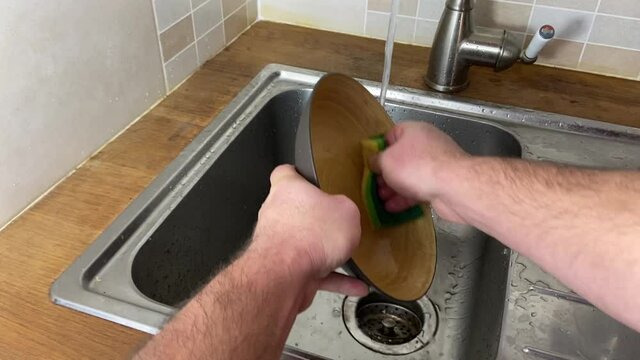
The height and width of the screenshot is (360, 640). I want to click on scouring pad, so click(x=370, y=141).